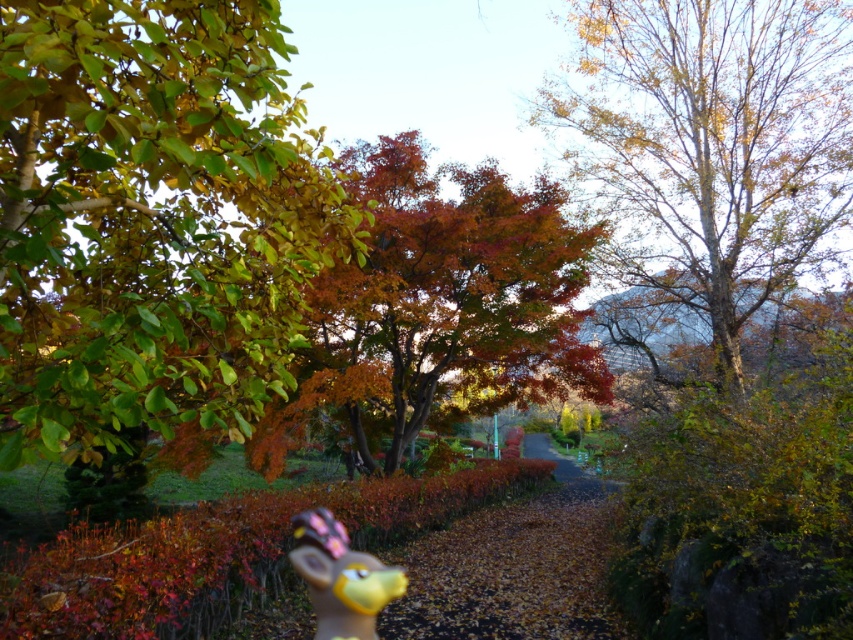
Looking at this image, who is more forward, (x=189, y=288) or (x=537, y=456)?

Point (x=189, y=288)

Which is more to the left, shiny green leaves at upper left or brown dirt path at center?

Positioned to the left is shiny green leaves at upper left.

Between point (113, 365) and point (577, 486), which one is positioned in front?

Point (113, 365) is in front.

Identify the location of shiny green leaves at upper left. The width and height of the screenshot is (853, 640). (151, 225).

Between autumn leaves at center and brown dirt path at center, which one appears on the right side from the viewer's perspective?

brown dirt path at center

You are a GUI agent. You are given a task and a screenshot of the screen. Output one action in this format:
    pyautogui.click(x=<x>, y=<y>)
    Task: Click on the autumn leaves at center
    
    Given the screenshot: What is the action you would take?
    pyautogui.click(x=440, y=307)

This screenshot has width=853, height=640. What are the coordinates of `autumn leaves at center` in the screenshot? It's located at (440, 307).

Does shiny green leaves at upper left appear over autumn leaves at center?

No.

Which is more to the left, shiny green leaves at upper left or autumn leaves at center?

Positioned to the left is shiny green leaves at upper left.

Image resolution: width=853 pixels, height=640 pixels. I want to click on shiny green leaves at upper left, so click(151, 225).